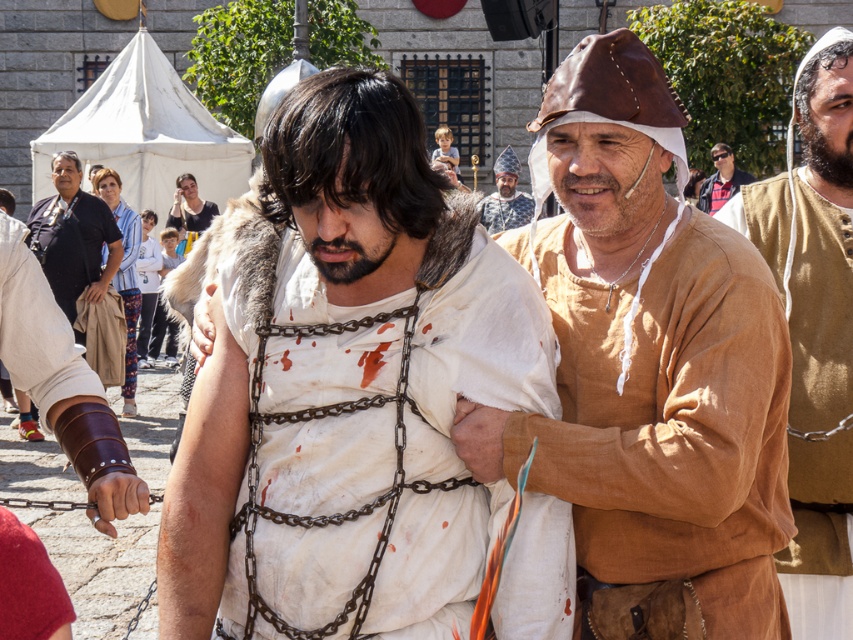
You are an observer in the scene described. You notice the brown linen shirt at right and the light blue striped shirt at center. Which shirt is closer to the ground?

The brown linen shirt at right is positioned under the light blue striped shirt at center, so it is closer to the ground.

You are an event organizer planning to arrange these two shirts in a display case. The case has two shelves, with the top shelf designated for smaller items and the bottom shelf for larger items. Based on the scene, where should you place the brown linen shirt at right and the light blue striped shirt at center?

The brown linen shirt at right is smaller than the light blue striped shirt at center, so the brown linen shirt at right should be placed on the top shelf and the light blue striped shirt at center on the bottom shelf.

You are a stagehand positioned 10 meters away from the front of the stage. You need to adjust the lighting for the actor wearing the brown linen shirt at right. Can you reach them from your current position?

The brown linen shirt at right is 13.45 meters away from the viewer. Since you are 10 meters from the front, you are 3.45 meters away from the actor, so you can reach them.